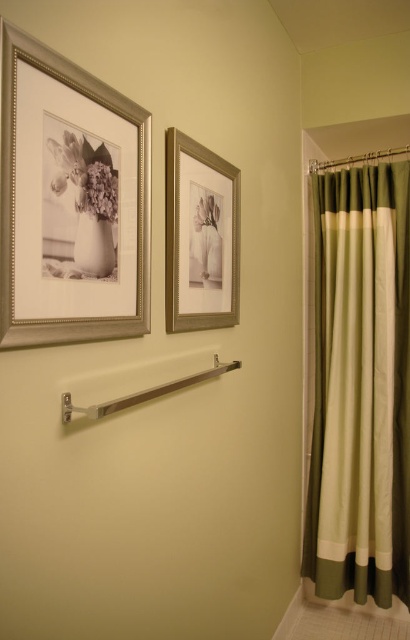
You are arranging flowers in a bathroom with two vases. The matte white vase at upper left and the white glossy vase at upper left are both on the same wall. If you want to place a bouquet that requires 3 inches of space between the vases, will the current spacing work?

The matte white vase at upper left is 2.21 inches from the white glossy vase at upper left, which is less than the required 3 inches. Therefore, the current spacing is insufficient for the bouquet that needs 3 inches between them.

You are hanging a new picture frame in the bathroom and want to place it between the existing matte silver picture frame at upper center and the matte floral print at upper left. Based on their current positions, which side should you place the new frame on to maintain symmetry?

To maintain symmetry, place the new frame to the left of the matte floral print at upper left and to the right of the matte silver picture frame at upper center. However, since the matte silver picture frame at upper center is already to the right of the matte floral print at upper left, the new frame should be placed between them, closer to the center if symmetry is desired.

You are standing in the bathroom and want to reach the matte white vase at upper left. The longest object you have is a 24 inch extendable pole. Can you reach it with the pole?

The matte white vase at upper left is 28.34 inches away from the viewer. Since the extendable pole is only 24 inches long, it is not long enough to reach the vase.